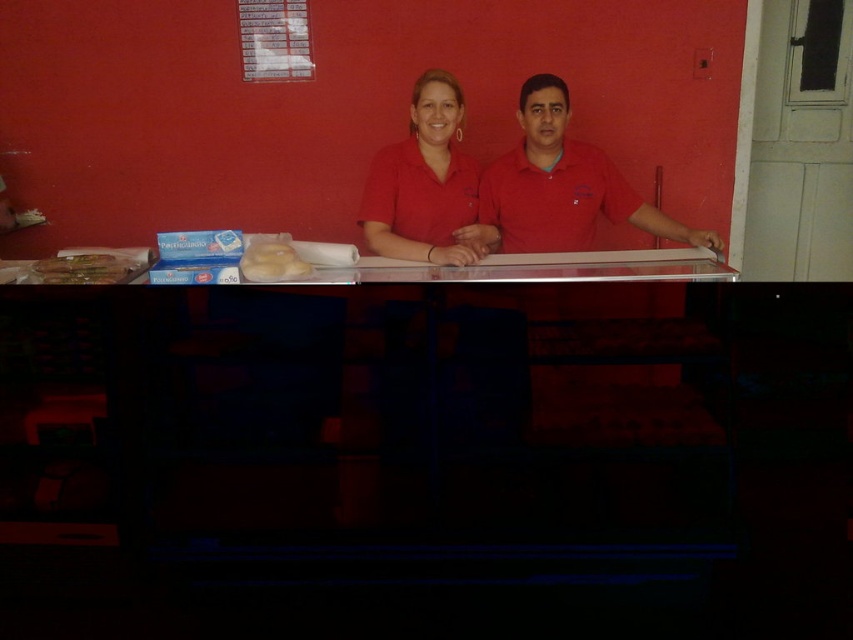
Question: Is red matte shirt at center closer to the viewer compared to matte red shirt at center?

Choices:
 (A) no
 (B) yes

Answer: (A)

Question: Among these points, which one is farthest from the camera?

Choices:
 (A) (54, 278)
 (B) (532, 163)
 (C) (432, 193)
 (D) (291, 250)

Answer: (B)

Question: Among these objects, which one is farthest from the camera?

Choices:
 (A) matte brown bread at left
 (B) white fluffy bread at center

Answer: (B)

Question: Does red matte shirt at center have a smaller size compared to matte red shirt at center?

Choices:
 (A) no
 (B) yes

Answer: (A)

Question: Which object is farther from the camera taking this photo?

Choices:
 (A) white fluffy bread at center
 (B) red matte shirt at center

Answer: (B)

Question: Does red matte shirt at center appear over white fluffy bread at center?

Choices:
 (A) yes
 (B) no

Answer: (A)